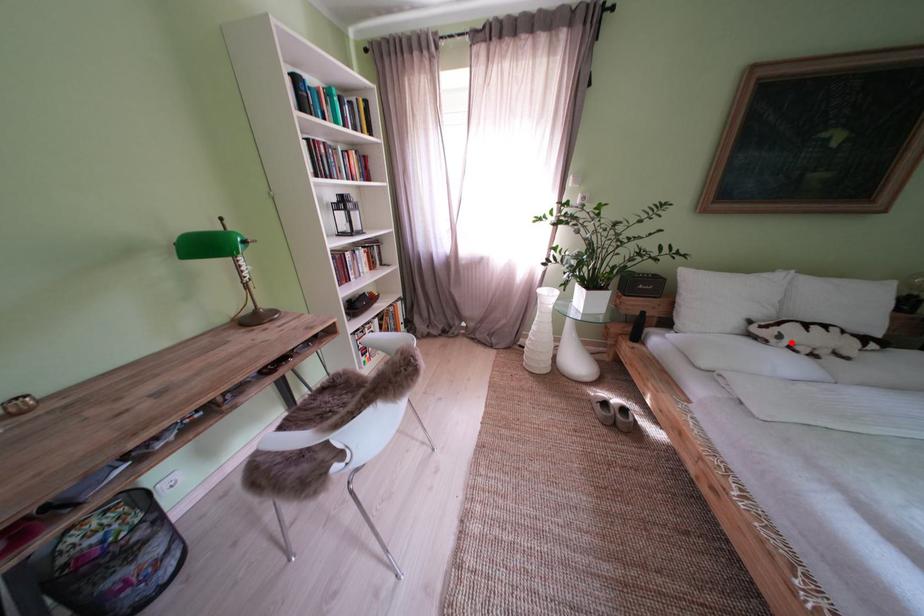
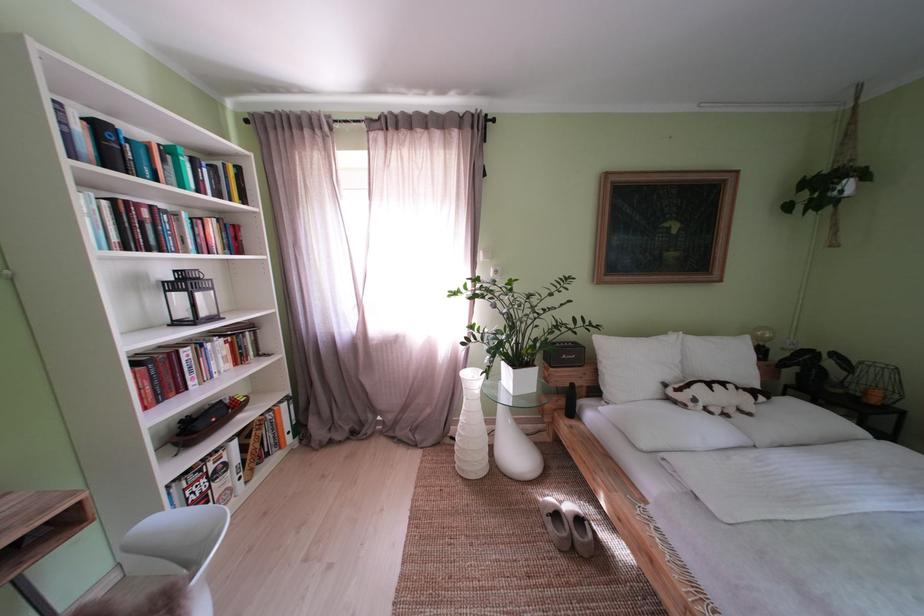
Question: A red point is marked in image1. In image2, is the corresponding 3D point closer to the camera or farther? Reply with the corresponding letter.

Choices:
 (A) The corresponding 3D point is closer.
 (B) The corresponding 3D point is farther.

Answer: (B)